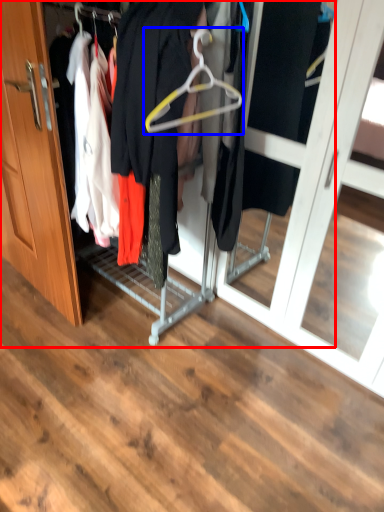
Question: Which point is further to the camera, closet (highlighted by a red box) or hanger (highlighted by a blue box)?

Choices:
 (A) closet
 (B) hanger

Answer: (B)